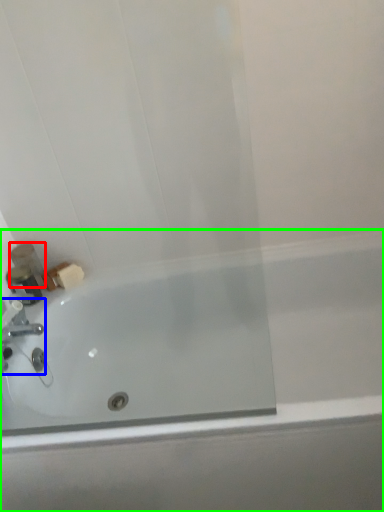
Question: Which is farther away from toiletry (highlighted by a red box)? tap (highlighted by a blue box) or bathtub (highlighted by a green box)?

Choices:
 (A) tap
 (B) bathtub

Answer: (B)